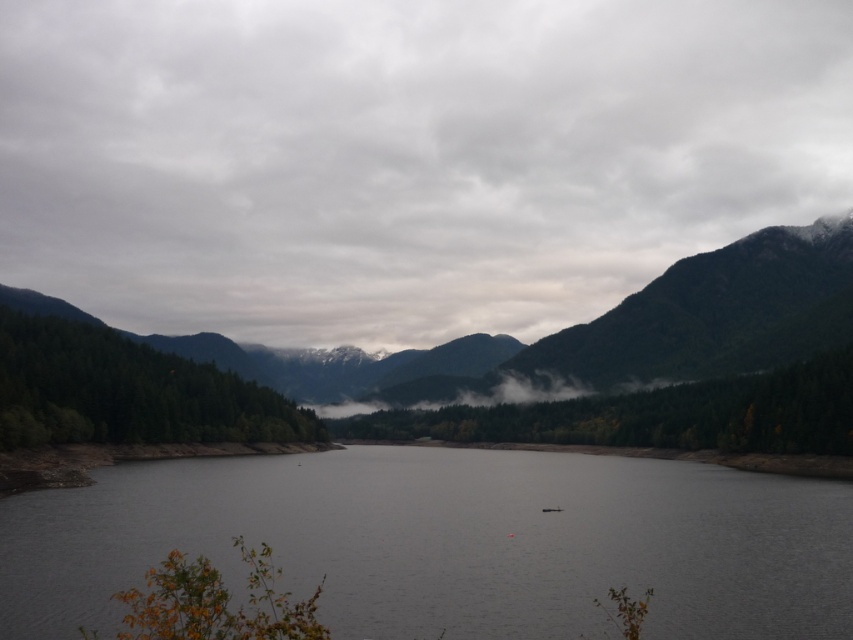
You are standing at the center of the image and want to walk towards the gray water at center. Which direction should you move in relation to the point marked at coordinates point (x=448, y=541)?

The gray water at center is located exactly at the point marked at coordinates point (x=448, y=541), so you are already at the desired location.

You are standing at the edge of the gray water at center and want to walk towards the green matte forest at center. Which direction should you head to reach the forest?

The gray water at center is in front of green matte forest at center, so you should head towards the direction away from the water to reach the forest.

You are standing at the center of the lake looking towards the mountains. There are two points marked in the image. Which point, point (297, 506) or point (659, 388), is closer to you?

Point (297, 506) is closer to the camera than point (659, 388), so it is closer to you.